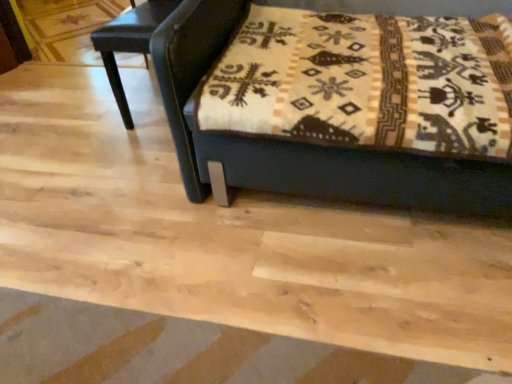
Where is `velvet-like dark blue studio couch at center`? velvet-like dark blue studio couch at center is located at coordinates (301, 143).

Describe the element at coordinates (301, 143) in the screenshot. I see `velvet-like dark blue studio couch at center` at that location.

What is the approximate height of velvet-like dark blue studio couch at center?

It is 28.51 inches.

This screenshot has height=384, width=512. In order to click on velvet-like dark blue studio couch at center in this screenshot , I will do `click(301, 143)`.